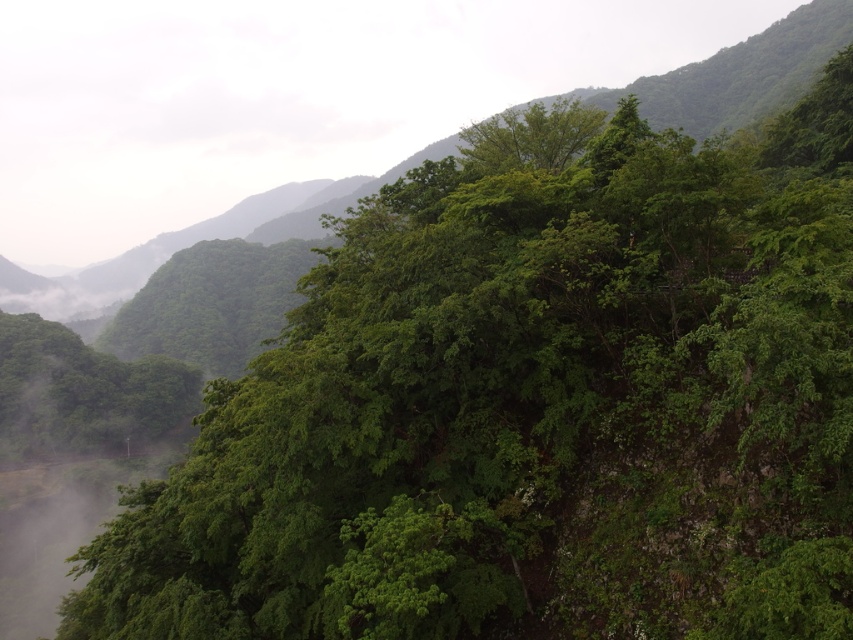
Question: Which point appears closest to the camera in this image?

Choices:
 (A) (521, 161)
 (B) (364, 177)

Answer: (A)

Question: Is green leafy mountain at center positioned before green leafy tree at upper center?

Choices:
 (A) no
 (B) yes

Answer: (A)

Question: Which point appears farthest from the camera in this image?

Choices:
 (A) (0, 296)
 (B) (561, 106)

Answer: (A)

Question: Can you confirm if green leafy mountain at center is bigger than green leafy tree at upper center?

Choices:
 (A) yes
 (B) no

Answer: (A)

Question: Is green leafy mountain at center in front of green leafy tree at upper center?

Choices:
 (A) yes
 (B) no

Answer: (B)